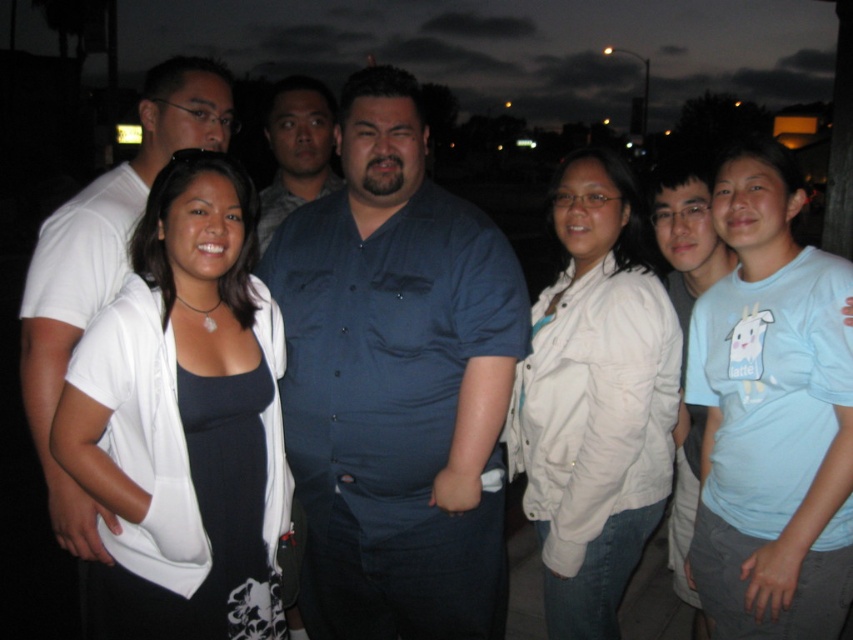
You are standing in front of the group photo and want to determine the relative positions of two points marked in the image. Which point, point (263, 572) or point (289, 198), is closer to you?

Point (263, 572) is closer to the viewer than point (289, 198).